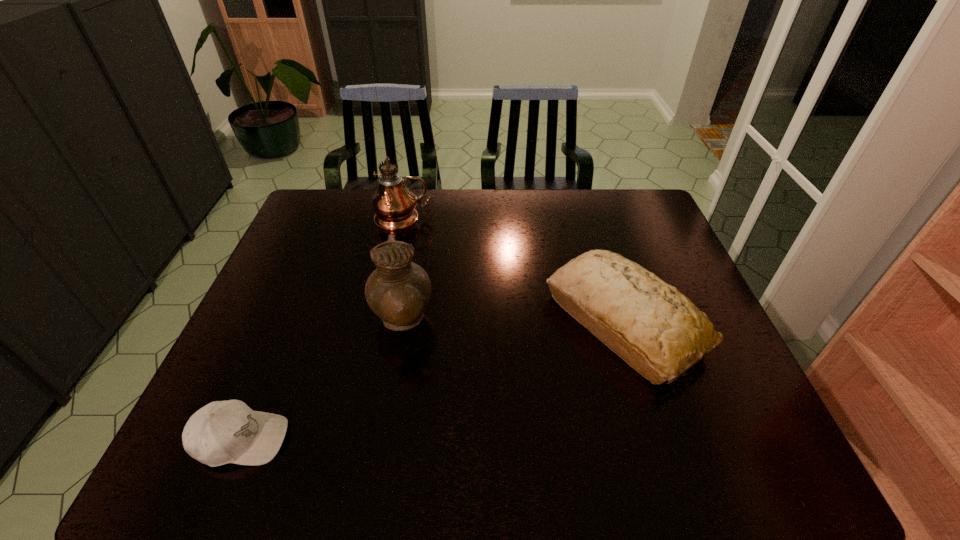
You are a GUI agent. You are given a task and a screenshot of the screen. Output one action in this format:
    pyautogui.click(x=<x>, y=<y>)
    Task: Click on the free space located 0.320m on the front-facing side of the shortest object
    Image resolution: width=960 pixels, height=540 pixels.
    Given the screenshot: What is the action you would take?
    pyautogui.click(x=443, y=440)

The image size is (960, 540). What are the coordinates of `object present at the far edge` in the screenshot? It's located at (394, 204).

The width and height of the screenshot is (960, 540). Identify the location of object present at the near edge. (222, 432).

Find the location of `object that is at the left edge`. object that is at the left edge is located at coordinates (222, 432).

You are a GUI agent. You are given a task and a screenshot of the screen. Output one action in this format:
    pyautogui.click(x=<x>, y=<y>)
    Task: Click on the object positioned at the right edge
    The image size is (960, 540).
    Given the screenshot: What is the action you would take?
    pyautogui.click(x=658, y=331)

Identify the location of object located at the near left corner. (222, 432).

This screenshot has width=960, height=540. In the image, there is a desktop. Identify the location of vacant space at the far edge. (565, 221).

Where is `free spot at the left edge of the desktop`? The height and width of the screenshot is (540, 960). free spot at the left edge of the desktop is located at coordinates (300, 282).

Where is `vacant space at the right edge of the desktop`? Image resolution: width=960 pixels, height=540 pixels. vacant space at the right edge of the desktop is located at coordinates (642, 248).

In order to click on free location at the far left corner of the desktop in this screenshot , I will do `click(343, 216)`.